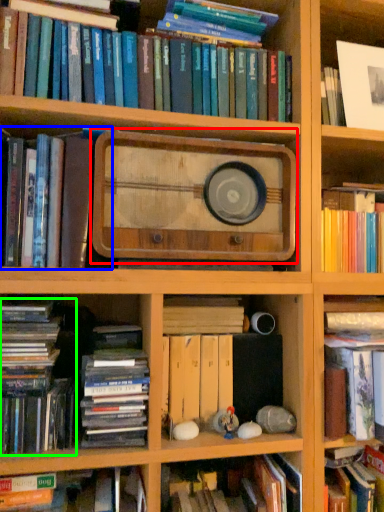
Question: Considering the real-world distances, which object is closest to paperback book (highlighted by a red box)? book (highlighted by a blue box) or book (highlighted by a green box).

Choices:
 (A) book
 (B) book

Answer: (A)